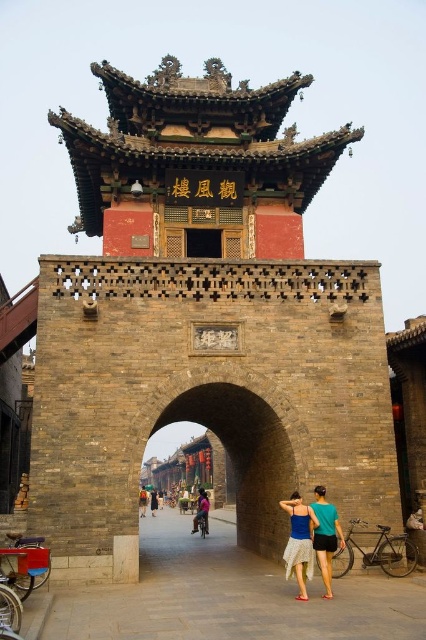
Does brown stone tower at center lie behind pink fabric dress at center?

No, brown stone tower at center is in front of pink fabric dress at center.

Does point (161, 256) come closer to viewer compared to point (207, 515)?

Yes, it is.

Locate an element on the screen. The width and height of the screenshot is (426, 640). brown stone tower at center is located at coordinates (203, 320).

Is blue denim skirt at center bigger than dark brown leather jacket at center?

Incorrect, blue denim skirt at center is not larger than dark brown leather jacket at center.

Between blue denim skirt at center and dark brown leather jacket at center, which one is positioned higher?

blue denim skirt at center is above.

Does point (296, 496) come in front of point (152, 490)?

That is True.

Locate an element on the screen. The image size is (426, 640). blue denim skirt at center is located at coordinates (310, 538).

Who is more forward, (340, 538) or (207, 508)?

Positioned in front is point (340, 538).

Who is more distant from viewer, (x=299, y=570) or (x=204, y=504)?

The point (x=204, y=504) is more distant.

You are a GUI agent. You are given a task and a screenshot of the screen. Output one action in this format:
    pyautogui.click(x=<x>, y=<y>)
    Task: Click on the blue denim skirt at center
    
    Given the screenshot: What is the action you would take?
    pyautogui.click(x=310, y=538)